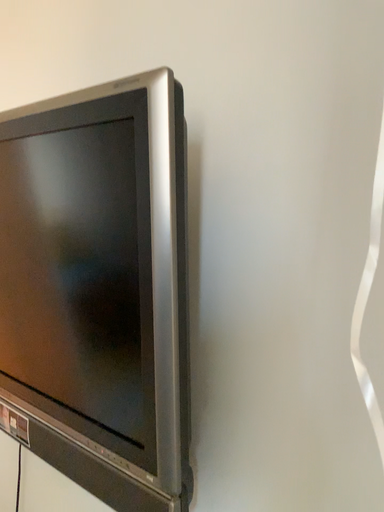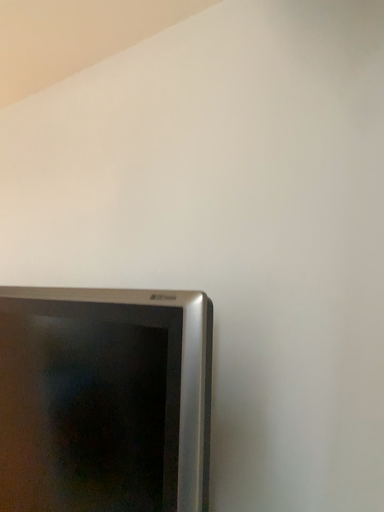
Question: How did the camera likely rotate when shooting the video?

Choices:
 (A) rotated upward
 (B) rotated downward

Answer: (A)